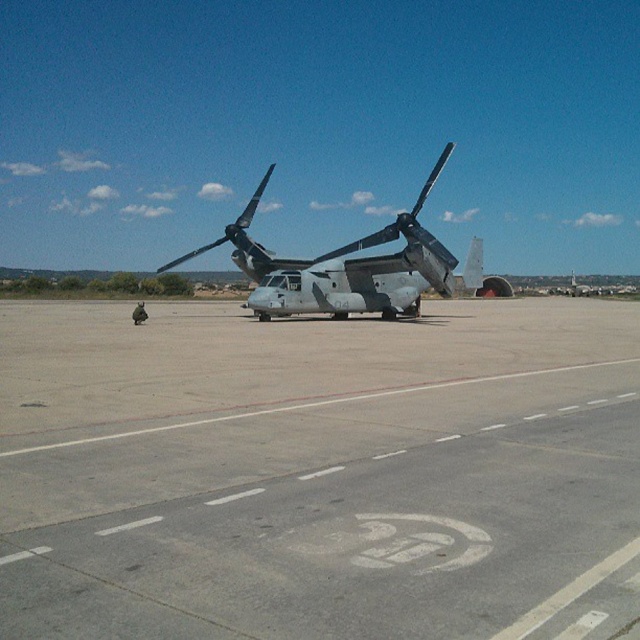
Who is positioned more to the right, gray concrete tarmac at center or camouflage fabric propeller at center?

gray concrete tarmac at center

Does gray concrete tarmac at center have a lesser width compared to camouflage fabric propeller at center?

No, gray concrete tarmac at center is not thinner than camouflage fabric propeller at center.

Measure the distance between gray concrete tarmac at center and camera.

gray concrete tarmac at center and camera are 11.96 feet apart from each other.

Identify the location of gray concrete tarmac at center. This screenshot has height=640, width=640. (317, 472).

Can you confirm if camouflage fabric helicopter at center is shorter than camouflage fabric propeller at center?

No, camouflage fabric helicopter at center is not shorter than camouflage fabric propeller at center.

Which is behind, point (449, 256) or point (228, 224)?

The point (228, 224) is more distant.

Find the location of a particular element. This screenshot has width=640, height=640. camouflage fabric helicopter at center is located at coordinates (342, 268).

Does gray concrete tarmac at center appear on the left side of camouflage fabric helicopter at center?

No, gray concrete tarmac at center is not to the left of camouflage fabric helicopter at center.

Between gray concrete tarmac at center and camouflage fabric helicopter at center, which one is positioned lower?

gray concrete tarmac at center is lower down.

The width and height of the screenshot is (640, 640). Describe the element at coordinates (317, 472) in the screenshot. I see `gray concrete tarmac at center` at that location.

Locate an element on the screen. This screenshot has height=640, width=640. gray concrete tarmac at center is located at coordinates [317, 472].